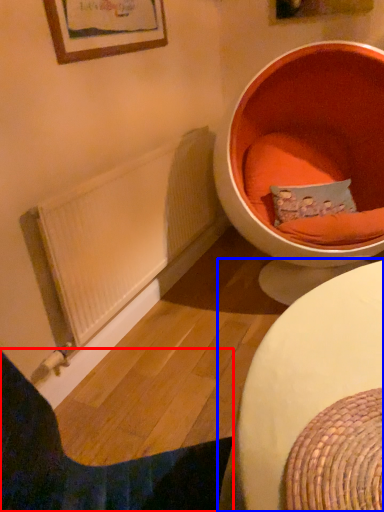
Question: Which point is further to the camera, furniture (highlighted by a red box) or table (highlighted by a blue box)?

Choices:
 (A) furniture
 (B) table

Answer: (A)